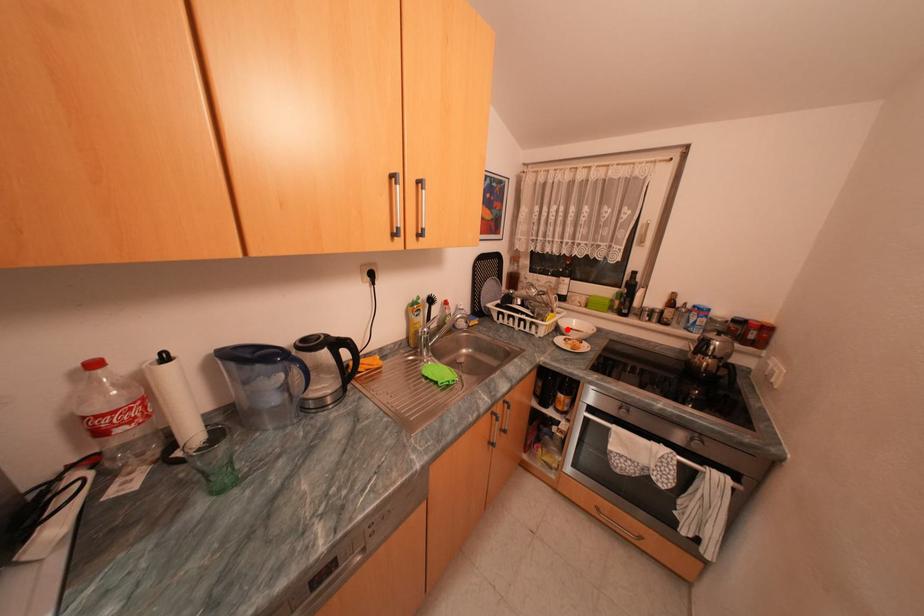
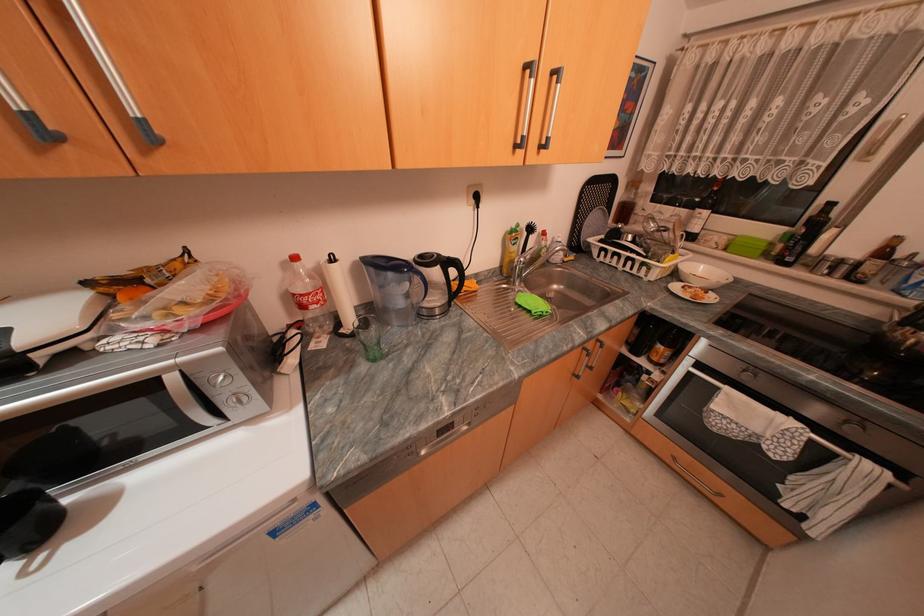
The point at the highlighted location is marked in the first image. Where is the corresponding point in the second image?

(685, 275)